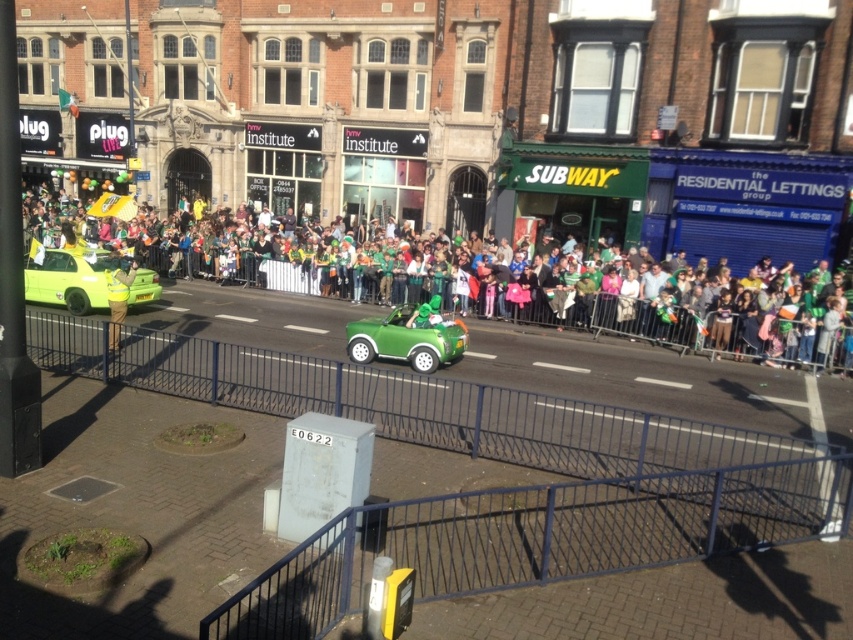
Question: Can you confirm if green fabric crowd at center is positioned to the right of green matte car at center?

Choices:
 (A) yes
 (B) no

Answer: (B)

Question: Is green fabric crowd at center to the right of matte green car at left from the viewer's perspective?

Choices:
 (A) no
 (B) yes

Answer: (B)

Question: Among these objects, which one is farthest from the camera?

Choices:
 (A) green fabric crowd at center
 (B) yellow reflective vest at left
 (C) matte green car at left

Answer: (C)

Question: Among these points, which one is farthest from the camera?

Choices:
 (A) (373, 234)
 (B) (392, 348)

Answer: (A)

Question: Which object is farther from the camera taking this photo?

Choices:
 (A) green matte car at center
 (B) matte green car at left

Answer: (B)

Question: Is matte green car at left positioned at the back of yellow reflective vest at left?

Choices:
 (A) no
 (B) yes

Answer: (B)